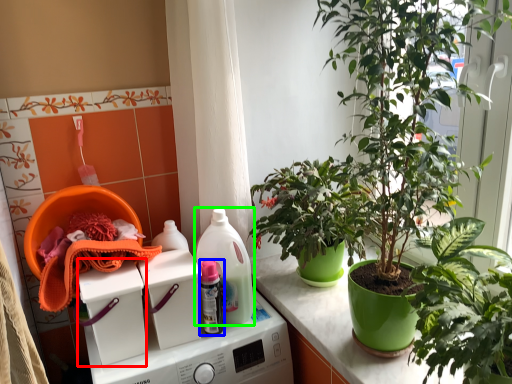
Question: Estimate the real-world distances between objects in this image. Which object is farther from washing machine (highlighted by a red box), bottle (highlighted by a blue box) or cleaning product (highlighted by a green box)?

Choices:
 (A) bottle
 (B) cleaning product

Answer: (B)